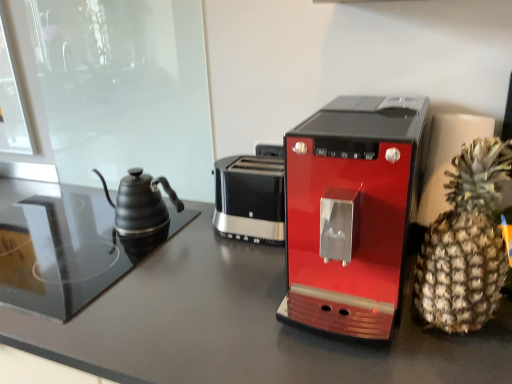
Find the location of a particular element. free space in front of matte black kettle at left is located at coordinates (99, 260).